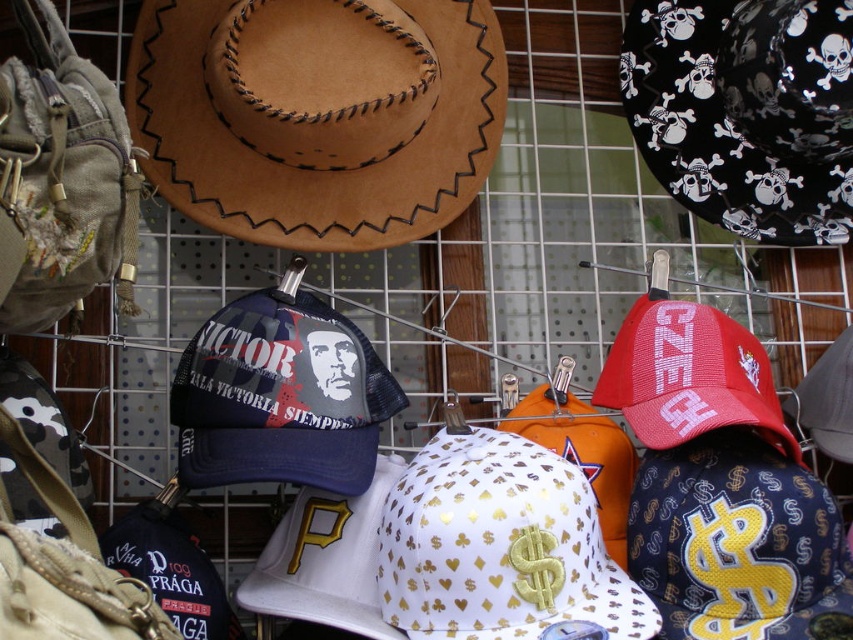
Question: Can you confirm if brown suede cowboy hat at upper left is bigger than gold metallic baseball cap at center?

Choices:
 (A) yes
 (B) no

Answer: (A)

Question: Is the position of brown suede cowboy hat at upper left more distant than that of black matte cowboy hat at upper right?

Choices:
 (A) yes
 (B) no

Answer: (B)

Question: Among these objects, which one is farthest from the camera?

Choices:
 (A) gold metallic baseball cap at center
 (B) brown suede cowboy hat at upper left
 (C) black matte cowboy hat at upper right

Answer: (C)

Question: Which object is closer to the camera taking this photo?

Choices:
 (A) brown suede cowboy hat at upper left
 (B) black matte cowboy hat at upper right
 (C) gold metallic baseball cap at center

Answer: (C)

Question: Does black matte cowboy hat at upper right appear on the right side of gold metallic baseball cap at center?

Choices:
 (A) no
 (B) yes

Answer: (B)

Question: Which is nearer to the gold metallic baseball cap at center?

Choices:
 (A) black matte cowboy hat at upper right
 (B) brown suede cowboy hat at upper left

Answer: (B)